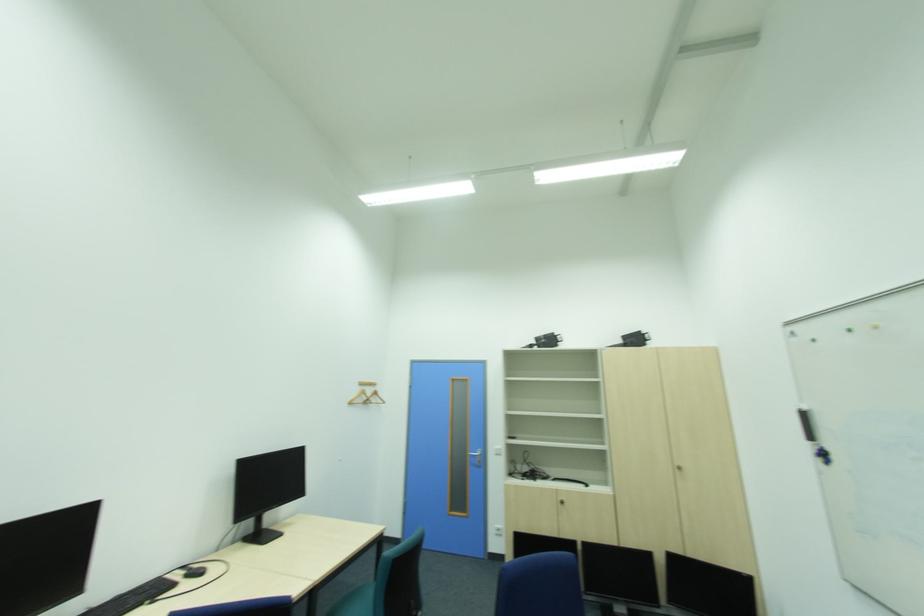
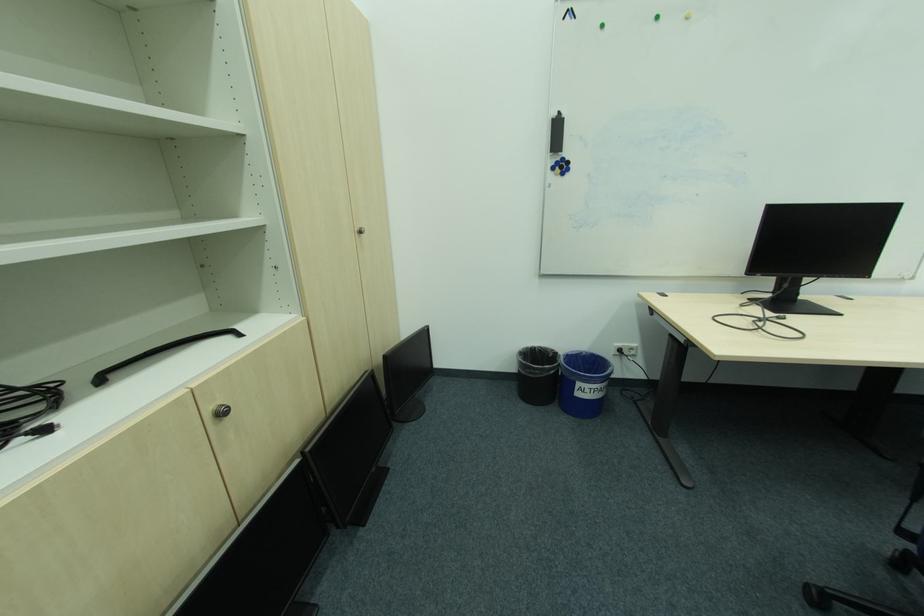
In the second image, find the point that corresponds to (x=568, y=503) in the first image.

(227, 415)